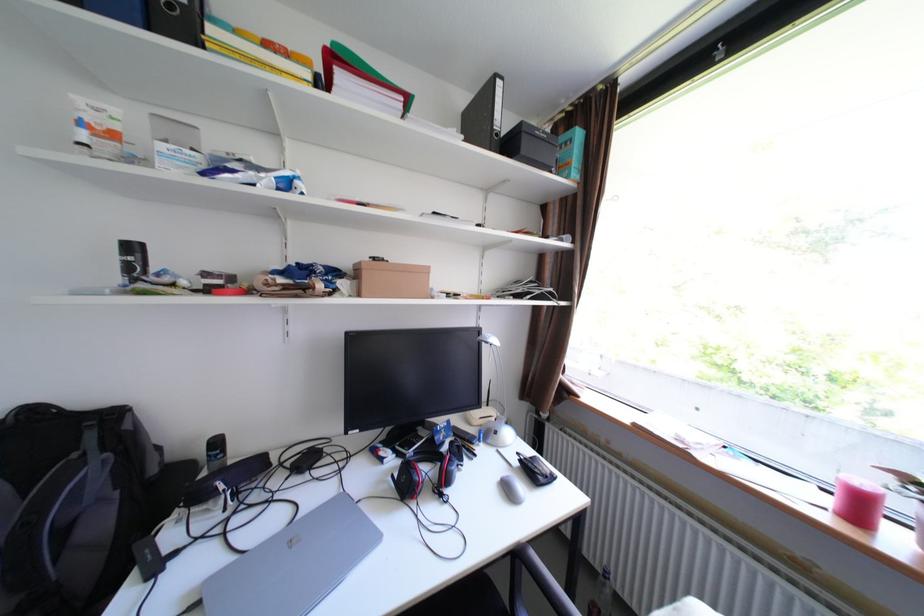
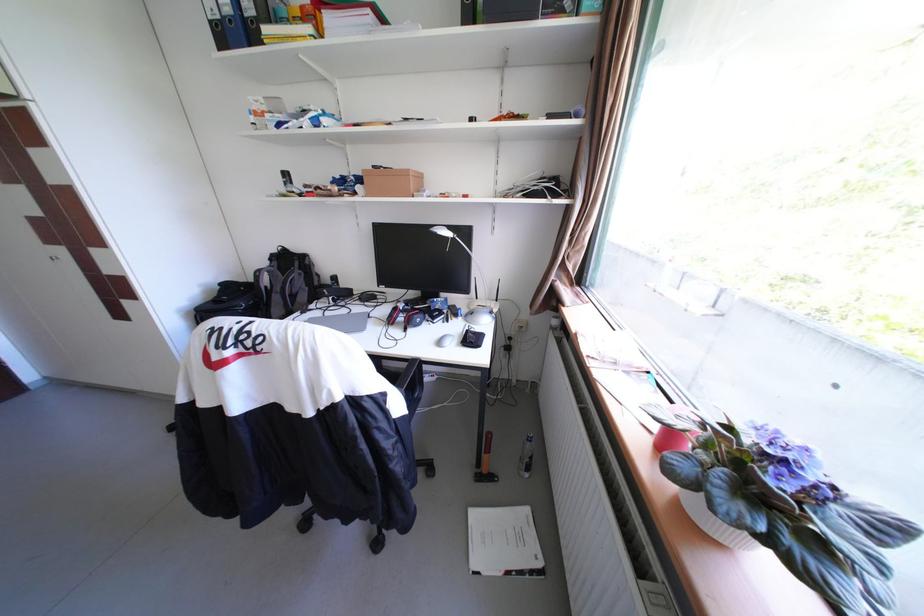
The images are taken continuously from a first-person perspective. In which direction is your viewpoint rotating?

The camera rotated toward left-down.